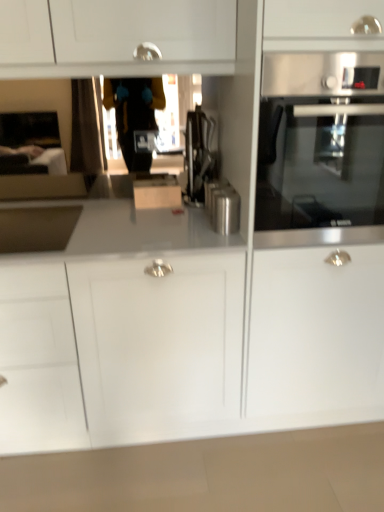
Image resolution: width=384 pixels, height=512 pixels. I want to click on free space above satin nickel sink at left (from a real-world perspective), so click(x=30, y=215).